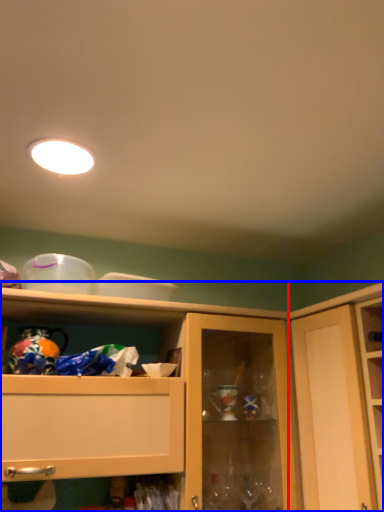
Question: Among these objects, which one is farthest to the camera, cupboard (highlighted by a red box) or cabinetry (highlighted by a blue box)?

Choices:
 (A) cupboard
 (B) cabinetry

Answer: (B)